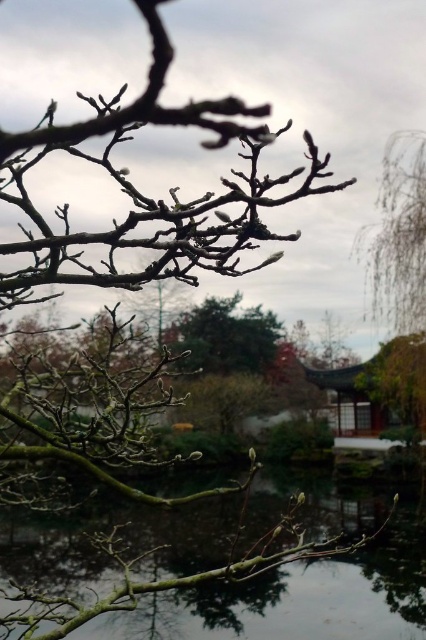
From the picture: Does bare branches at upper center appear on the right side of green matte tree branch at center?

Incorrect, bare branches at upper center is not on the right side of green matte tree branch at center.

Can you confirm if bare branches at upper center is positioned below green matte tree branch at center?

Actually, bare branches at upper center is above green matte tree branch at center.

The height and width of the screenshot is (640, 426). Find the location of `bare branches at upper center`. bare branches at upper center is located at coordinates (146, 196).